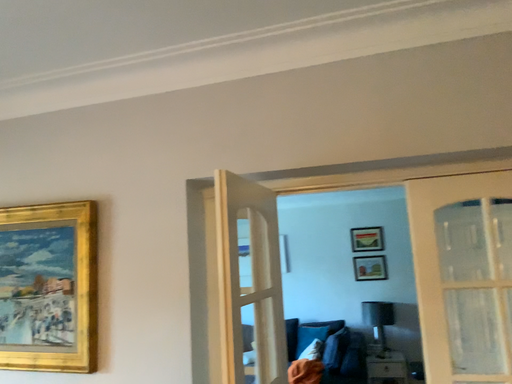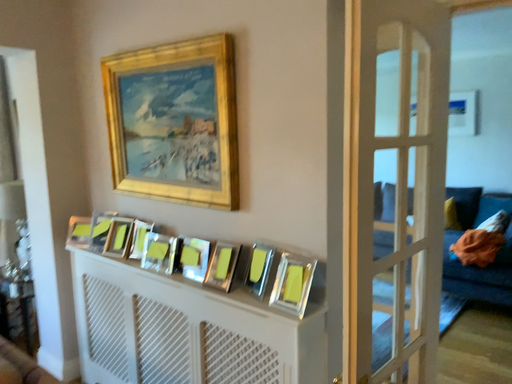
Question: Which way did the camera rotate in the video?

Choices:
 (A) rotated downward
 (B) rotated upward

Answer: (A)